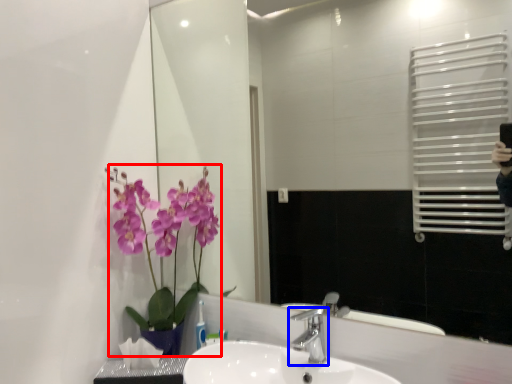
Question: Which object appears closest to the camera in this image, floral arrangement (highlighted by a red box) or tap (highlighted by a blue box)?

Choices:
 (A) floral arrangement
 (B) tap

Answer: (B)